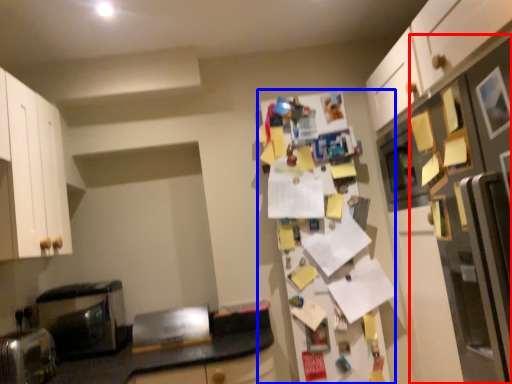
Question: Among these objects, which one is farthest to the camera, fridge (highlighted by a red box) or fridge (highlighted by a blue box)?

Choices:
 (A) fridge
 (B) fridge

Answer: (B)